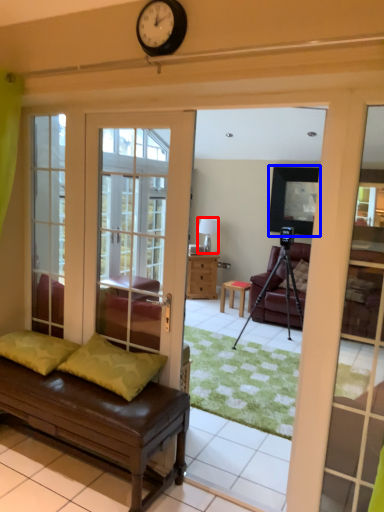
Question: Which object is further to the camera taking this photo, lamp (highlighted by a red box) or window screen (highlighted by a blue box)?

Choices:
 (A) lamp
 (B) window screen

Answer: (A)